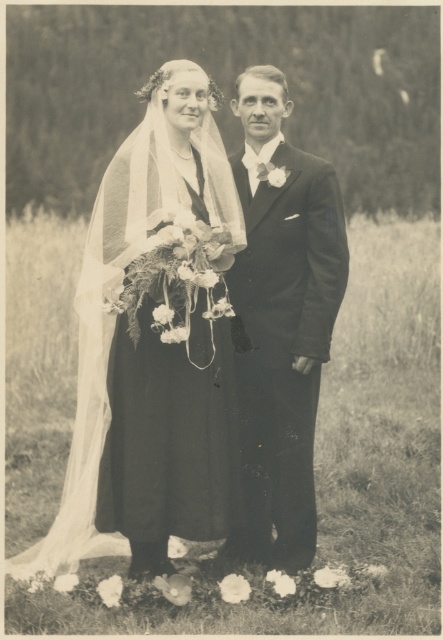
You are a photographer who needs to adjust the lighting for the couple in the image. The silky satin dress at center is reflecting more light than the smooth black suit at center. Which object should you adjust the lighting for to reduce glare?

The silky satin dress at center is reflecting more light, so you should adjust the lighting for the silky satin dress at center to reduce glare.